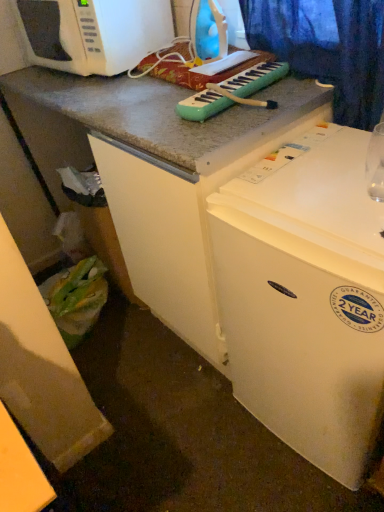
Question: Can you confirm if white matte microwave oven at upper left is shorter than white matte refrigerator at upper right?

Choices:
 (A) yes
 (B) no

Answer: (A)

Question: From the image's perspective, is white matte microwave oven at upper left below white matte refrigerator at upper right?

Choices:
 (A) yes
 (B) no

Answer: (B)

Question: From a real-world perspective, does white matte microwave oven at upper left sit lower than white matte refrigerator at upper right?

Choices:
 (A) no
 (B) yes

Answer: (A)

Question: From a real-world perspective, is white matte microwave oven at upper left positioned over white matte refrigerator at upper right based on gravity?

Choices:
 (A) no
 (B) yes

Answer: (B)

Question: Is white matte microwave oven at upper left further to camera compared to white matte refrigerator at upper right?

Choices:
 (A) yes
 (B) no

Answer: (A)

Question: From the image's perspective, is white matte microwave oven at upper left over white matte refrigerator at upper right?

Choices:
 (A) yes
 (B) no

Answer: (A)

Question: From a real-world perspective, is white matte microwave oven at upper left positioned under transparent glass at upper right based on gravity?

Choices:
 (A) yes
 (B) no

Answer: (B)

Question: Is transparent glass at upper right surrounded by white matte microwave oven at upper left?

Choices:
 (A) no
 (B) yes

Answer: (A)

Question: Would you consider white matte microwave oven at upper left to be distant from transparent glass at upper right?

Choices:
 (A) no
 (B) yes

Answer: (A)

Question: Is white matte microwave oven at upper left positioned in front of transparent glass at upper right?

Choices:
 (A) no
 (B) yes

Answer: (A)

Question: Considering the relative sizes of white matte microwave oven at upper left and transparent glass at upper right in the image provided, is white matte microwave oven at upper left wider than transparent glass at upper right?

Choices:
 (A) yes
 (B) no

Answer: (A)

Question: Is white matte microwave oven at upper left smaller than transparent glass at upper right?

Choices:
 (A) no
 (B) yes

Answer: (A)

Question: Is white matte refrigerator at upper right shorter than white matte microwave oven at upper left?

Choices:
 (A) no
 (B) yes

Answer: (A)